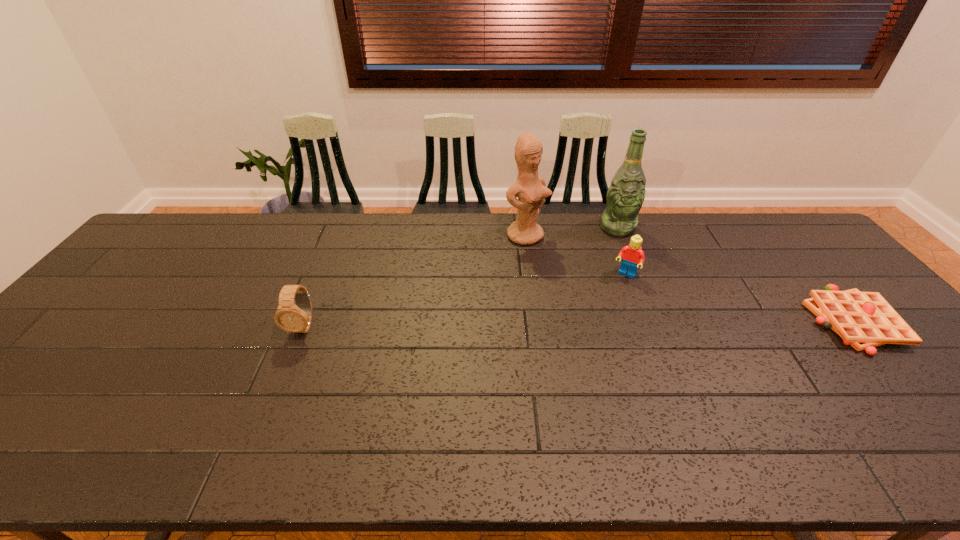
In the image, there is a desktop. Where is `vacant space at the far edge`? The height and width of the screenshot is (540, 960). vacant space at the far edge is located at coordinates (427, 244).

At what (x,y) coordinates should I click in order to perform the action: click on free space at the near edge. Please return your answer as a coordinate pair (x, y). The height and width of the screenshot is (540, 960). Looking at the image, I should click on (489, 400).

The height and width of the screenshot is (540, 960). In the image, there is a desktop. Find the location of `free space at the left edge`. free space at the left edge is located at coordinates (139, 294).

This screenshot has height=540, width=960. In the image, there is a desktop. What are the coordinates of `vacant space at the far left corner` in the screenshot? It's located at (207, 223).

Where is `free location at the near left corner`? This screenshot has width=960, height=540. free location at the near left corner is located at coordinates (31, 393).

The image size is (960, 540). I want to click on vacant space at the far right corner, so click(x=811, y=242).

Find the location of a particular element. vacant area that lies between the leftmost object and the fourth object from right to left is located at coordinates (415, 281).

You are a GUI agent. You are given a task and a screenshot of the screen. Output one action in this format:
    pyautogui.click(x=<x>, y=<y>)
    Task: Click on the free spot between the rightmost object and the watch
    This screenshot has width=960, height=540.
    Given the screenshot: What is the action you would take?
    pyautogui.click(x=579, y=323)

The width and height of the screenshot is (960, 540). I want to click on free spot between the third farthest object and the watch, so click(x=465, y=301).

Locate an element on the screen. This screenshot has height=540, width=960. free point between the figurine and the leftmost object is located at coordinates coord(415,281).